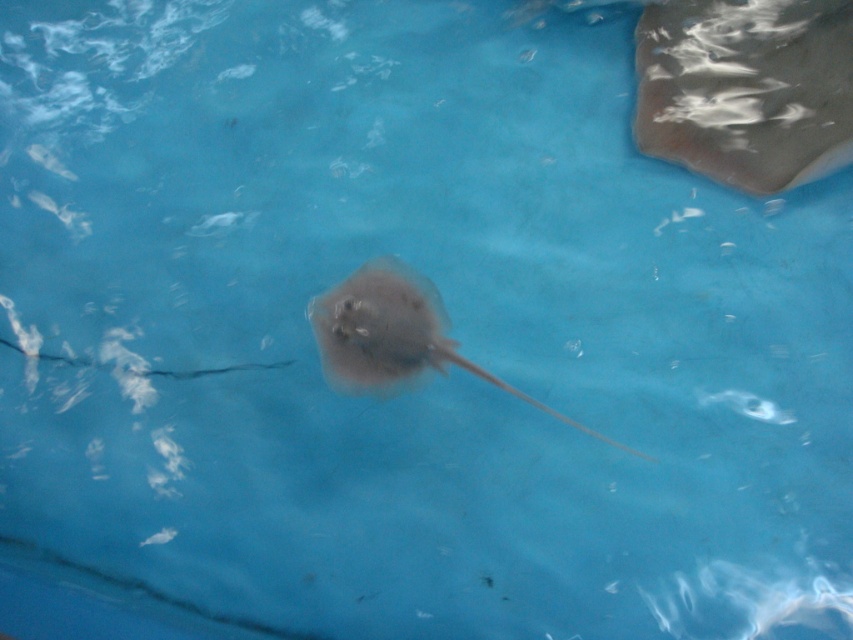
You are an aquatic biologist observing the aquarium. You notice two stingrays in the image. Which one is closer to you, the translucent rubber stingray at upper right or the smooth gray stingray at center?

The translucent rubber stingray at upper right is closer to you because it is positioned further to the viewer than the smooth gray stingray at center.

You are a photographer standing in front of an aquarium. You want to take a closeup photo of the translucent rubber stingray at upper right. The camera you are using has a maximum focus distance of 2 meters. Will you be able to focus on the stingray without moving closer?

The translucent rubber stingray at upper right and camera are 2.29 meters apart. Since the maximum focus distance is 2 meters, the camera cannot focus on the stingray without moving closer.